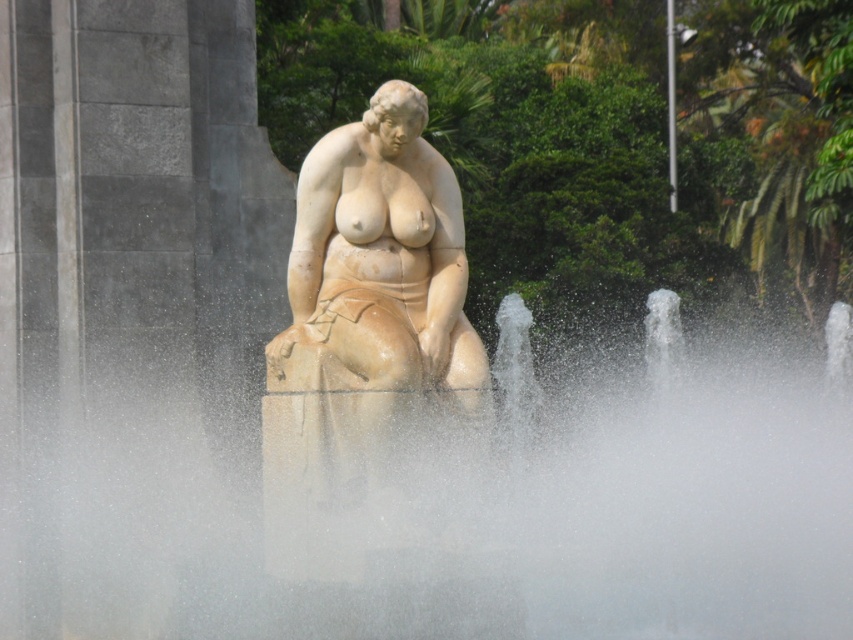
Question: Which of the following is the farthest from the observer?

Choices:
 (A) (357, 621)
 (B) (424, 156)

Answer: (B)

Question: Which point appears closest to the camera in this image?

Choices:
 (A) (596, 634)
 (B) (305, 310)

Answer: (A)

Question: Which of the following is the farthest from the observer?

Choices:
 (A) white marble statue at center
 (B) white frothy water at center

Answer: (A)

Question: Is white frothy water at center to the left of white marble statue at center from the viewer's perspective?

Choices:
 (A) yes
 (B) no

Answer: (B)

Question: From the image, what is the correct spatial relationship of white frothy water at center in relation to white marble statue at center?

Choices:
 (A) above
 (B) below

Answer: (B)

Question: Is white frothy water at center above white marble statue at center?

Choices:
 (A) no
 (B) yes

Answer: (A)